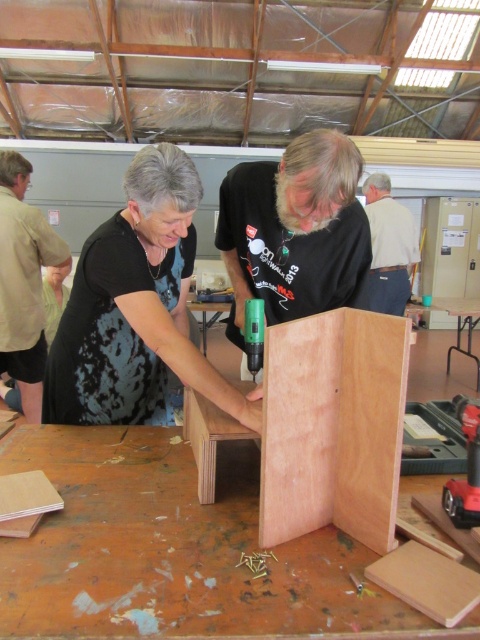
Question: Is plywood table at center to the left of green plastic drill at center from the viewer's perspective?

Choices:
 (A) no
 (B) yes

Answer: (B)

Question: Is plywood table at center behind green plastic drill at lower right?

Choices:
 (A) yes
 (B) no

Answer: (B)

Question: Can you confirm if matte black drill at center is positioned below light beige shirt at upper right?

Choices:
 (A) yes
 (B) no

Answer: (A)

Question: Which point is farther from the camera taking this photo?

Choices:
 (A) 474,508
 (B) 205,346
 (C) 392,326

Answer: (B)

Question: Which object appears farthest from the camera in this image?

Choices:
 (A) brown leather shirt at upper center
 (B) plywoodwooden/plaincabinet/structure at center
 (C) light beige shirt at upper right

Answer: (C)

Question: Among these points, which one is nearest to the camera?

Choices:
 (A) (249, 308)
 (B) (236, 305)
 (C) (382, 438)

Answer: (C)